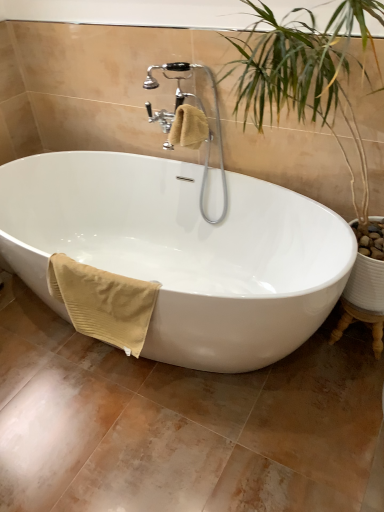
How much space does beige ribbed towel at lower left, which is counted as the 2th bath towel, starting from the top, occupy vertically?

14.10 inches.

This screenshot has height=512, width=384. Describe the element at coordinates (182, 251) in the screenshot. I see `white glossy bathtub at center` at that location.

The width and height of the screenshot is (384, 512). In order to click on beige cotton towel at upper center, placed as the first bath towel when sorted from top to bottom in this screenshot , I will do coord(188,127).

Locate an element on the screen. The height and width of the screenshot is (512, 384). polished chrome faucet at upper center is located at coordinates (189, 125).

Is white glossy bathtub at center looking in the opposite direction of polished chrome faucet at upper center?

white glossy bathtub at center does not have its back to polished chrome faucet at upper center.

How many degrees apart are the facing directions of white glossy bathtub at center and polished chrome faucet at upper center?

0.219 degrees separate the facing orientations of white glossy bathtub at center and polished chrome faucet at upper center.

Is white glossy bathtub at center situated inside polished chrome faucet at upper center or outside?

white glossy bathtub at center is not inside polished chrome faucet at upper center, it's outside.

From a real-world perspective, does polished chrome faucet at upper center stand above beige cotton towel at upper center, placed as the first bath towel when sorted from right to left?

No, from a real-world perspective, polished chrome faucet at upper center is not on top of beige cotton towel at upper center, placed as the first bath towel when sorted from right to left.

Considering the positions of objects polished chrome faucet at upper center and beige cotton towel at upper center, placed as the first bath towel when sorted from top to bottom, in the image provided, who is more to the left, polished chrome faucet at upper center or beige cotton towel at upper center, placed as the first bath towel when sorted from top to bottom,?

polished chrome faucet at upper center is more to the left.

Is point (226, 189) in front of point (190, 109)?

No, it is behind (190, 109).

Could beige cotton towel at upper center, the second bath towel in the bottom-to-top sequence, be considered to be inside polished chrome faucet at upper center?

Yes, beige cotton towel at upper center, the second bath towel in the bottom-to-top sequence, is surrounded by polished chrome faucet at upper center.

Would you say white glossy bathtub at center is a long distance from beige cotton towel at upper center, the second bath towel in the bottom-to-top sequence?

No, white glossy bathtub at center is in close proximity to beige cotton towel at upper center, the second bath towel in the bottom-to-top sequence.

Is point (142, 183) less distant than point (190, 126)?

No, (142, 183) is behind (190, 126).

Do you think white glossy bathtub at center is within beige cotton towel at upper center, the second bath towel in the bottom-to-top sequence, or outside of it?

white glossy bathtub at center is not inside beige cotton towel at upper center, the second bath towel in the bottom-to-top sequence, it's outside.

Could you tell me if white glossy bathtub at center is turned towards beige cotton towel at upper center, placed as the first bath towel when sorted from right to left?

No, white glossy bathtub at center is not oriented towards beige cotton towel at upper center, placed as the first bath towel when sorted from right to left.

From the image's perspective, is beige cotton towel at upper center, the second bath towel in the bottom-to-top sequence, located above or below white glossy bathtub at center?

From the image's perspective, beige cotton towel at upper center, the second bath towel in the bottom-to-top sequence, appears above white glossy bathtub at center.

Can you confirm if beige cotton towel at upper center, placed as the first bath towel when sorted from right to left, is positioned to the left of white glossy bathtub at center?

Incorrect, beige cotton towel at upper center, placed as the first bath towel when sorted from right to left, is not on the left side of white glossy bathtub at center.

From a real-world perspective, is beige cotton towel at upper center, which appears as the 2th bath towel when viewed from the left, located beneath white glossy bathtub at center?

No, from a real-world perspective, beige cotton towel at upper center, which appears as the 2th bath towel when viewed from the left, is not under white glossy bathtub at center.

Considering the sizes of objects beige cotton towel at upper center, the second bath towel in the bottom-to-top sequence, and white glossy bathtub at center in the image provided, who is taller, beige cotton towel at upper center, the second bath towel in the bottom-to-top sequence, or white glossy bathtub at center?

white glossy bathtub at center.

What's the angular difference between beige cotton towel at upper center, the second bath towel in the bottom-to-top sequence, and polished chrome faucet at upper center's facing directions?

1.08 degrees.

Are beige cotton towel at upper center, placed as the first bath towel when sorted from right to left, and polished chrome faucet at upper center located far from each other?

No, beige cotton towel at upper center, placed as the first bath towel when sorted from right to left, is not far from polished chrome faucet at upper center.

Based on the photo, is beige cotton towel at upper center, placed as the first bath towel when sorted from top to bottom, looking in the opposite direction of polished chrome faucet at upper center?

Yes, polished chrome faucet at upper center is at the back of beige cotton towel at upper center, placed as the first bath towel when sorted from top to bottom.

Which object is thinner, beige cotton towel at upper center, which appears as the 2th bath towel when viewed from the left, or polished chrome faucet at upper center?

beige cotton towel at upper center, which appears as the 2th bath towel when viewed from the left, is thinner.

Between white glossy bathtub at center and beige ribbed towel at lower left, which is counted as the 1th bath towel, starting from the left, which one has smaller size?

With smaller size is beige ribbed towel at lower left, which is counted as the 1th bath towel, starting from the left.

Which is more to the left, white glossy bathtub at center or beige ribbed towel at lower left, acting as the first bath towel starting from the bottom?

beige ribbed towel at lower left, acting as the first bath towel starting from the bottom.

In the scene shown: Which of these two, white glossy bathtub at center or beige ribbed towel at lower left, which is counted as the 2th bath towel, starting from the top, is wider?

With larger width is white glossy bathtub at center.

Is white glossy bathtub at center positioned far away from beige ribbed towel at lower left, which is counted as the 2th bath towel, starting from the top?

They are positioned close to each other.

Considering the points (224, 213) and (69, 284), which point is behind, point (224, 213) or point (69, 284)?

The point (224, 213) is more distant.

Is polished chrome faucet at upper center next to beige ribbed towel at lower left, which is the second bath towel in right-to-left order?

No, polished chrome faucet at upper center is not beside beige ribbed towel at lower left, which is the second bath towel in right-to-left order.

From the picture: Looking at the image, does polished chrome faucet at upper center seem bigger or smaller compared to beige ribbed towel at lower left, which is the second bath towel in right-to-left order?

polished chrome faucet at upper center is bigger than beige ribbed towel at lower left, which is the second bath towel in right-to-left order.

Locate an element on the screen. This screenshot has width=384, height=512. faucet that appears on the right of white glossy bathtub at center is located at coordinates (189, 125).

Identify the location of bath towel above the polished chrome faucet at upper center (from the image's perspective). (188, 127).

Estimate the real-world distances between objects in this image. Which object is closer to beige ribbed towel at lower left, which is the second bath towel in right-to-left order, white glossy bathtub at center or beige cotton towel at upper center, placed as the first bath towel when sorted from right to left?

white glossy bathtub at center.

From the image, which object appears to be farther from polished chrome faucet at upper center, beige ribbed towel at lower left, which is counted as the 1th bath towel, starting from the left, or white glossy bathtub at center?

beige ribbed towel at lower left, which is counted as the 1th bath towel, starting from the left, is further to polished chrome faucet at upper center.

Based on their spatial positions, is white glossy bathtub at center or beige ribbed towel at lower left, acting as the first bath towel starting from the bottom, closer to polished chrome faucet at upper center?

white glossy bathtub at center is closer to polished chrome faucet at upper center.

Which object lies nearer to the anchor point white glossy bathtub at center, beige ribbed towel at lower left, acting as the first bath towel starting from the bottom, or polished chrome faucet at upper center?

beige ribbed towel at lower left, acting as the first bath towel starting from the bottom, is closer to white glossy bathtub at center.

Considering their positions, is beige cotton towel at upper center, placed as the first bath towel when sorted from top to bottom, positioned closer to polished chrome faucet at upper center than beige ribbed towel at lower left, acting as the first bath towel starting from the bottom?

beige cotton towel at upper center, placed as the first bath towel when sorted from top to bottom.

When comparing their distances from white glossy bathtub at center, does beige ribbed towel at lower left, acting as the first bath towel starting from the bottom, or beige cotton towel at upper center, placed as the first bath towel when sorted from top to bottom, seem closer?

beige ribbed towel at lower left, acting as the first bath towel starting from the bottom.

Looking at this image, based on their spatial positions, is white glossy bathtub at center or polished chrome faucet at upper center further from beige cotton towel at upper center, placed as the first bath towel when sorted from top to bottom?

Among the two, white glossy bathtub at center is located further to beige cotton towel at upper center, placed as the first bath towel when sorted from top to bottom.

In the scene shown: Based on their spatial positions, is beige cotton towel at upper center, placed as the first bath towel when sorted from top to bottom, or white glossy bathtub at center closer to polished chrome faucet at upper center?

beige cotton towel at upper center, placed as the first bath towel when sorted from top to bottom, is positioned closer to the anchor polished chrome faucet at upper center.

What are the coordinates of `bathtub between polished chrome faucet at upper center and beige ribbed towel at lower left, which is the second bath towel in right-to-left order, vertically` in the screenshot? It's located at (182, 251).

At what (x,y) coordinates should I click in order to perform the action: click on bathtub that lies between beige cotton towel at upper center, the second bath towel in the bottom-to-top sequence, and beige ribbed towel at lower left, acting as the first bath towel starting from the bottom, from top to bottom. Please return your answer as a coordinate pair (x, y). This screenshot has width=384, height=512. Looking at the image, I should click on (182, 251).

This screenshot has height=512, width=384. In order to click on faucet between beige cotton towel at upper center, which appears as the 2th bath towel when viewed from the left, and white glossy bathtub at center from top to bottom in this screenshot , I will do `click(189, 125)`.

This screenshot has width=384, height=512. Identify the location of faucet that lies between beige cotton towel at upper center, the second bath towel in the bottom-to-top sequence, and beige ribbed towel at lower left, which is counted as the 1th bath towel, starting from the left, from top to bottom. click(x=189, y=125).